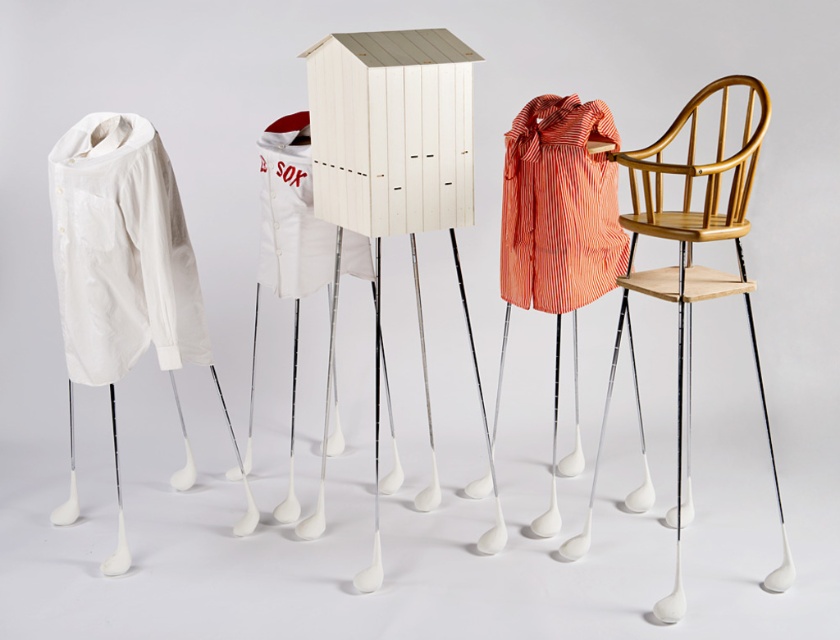
Who is positioned more to the right, wooden chair at center or white glossy golf club legs at center?

Positioned to the right is wooden chair at center.

Can you confirm if wooden chair at center is bigger than white glossy golf club legs at center?

No, wooden chair at center is not bigger than white glossy golf club legs at center.

This screenshot has width=840, height=640. What do you see at coordinates (558, 225) in the screenshot? I see `wooden chair at center` at bounding box center [558, 225].

You are a GUI agent. You are given a task and a screenshot of the screen. Output one action in this format:
    pyautogui.click(x=<x>, y=<y>)
    Task: Click on the wooden chair at center
    The width and height of the screenshot is (840, 640).
    Given the screenshot: What is the action you would take?
    pyautogui.click(x=558, y=225)

In the scene shown: Is wooden high chair at right to the right of striped cotton shirt at right from the viewer's perspective?

Indeed, wooden high chair at right is positioned on the right side of striped cotton shirt at right.

Measure the distance between wooden high chair at right and camera.

The distance of wooden high chair at right from camera is 2.11 meters.

Locate an element on the screen. The image size is (840, 640). wooden high chair at right is located at coordinates (690, 275).

Looking at this image, does white fabric shirt at left appear under white cotton baseball jersey at center?

Yes.

Who is more forward, (187, 262) or (289, 292)?

Point (187, 262) is more forward.

The width and height of the screenshot is (840, 640). I want to click on white fabric shirt at left, so click(x=126, y=273).